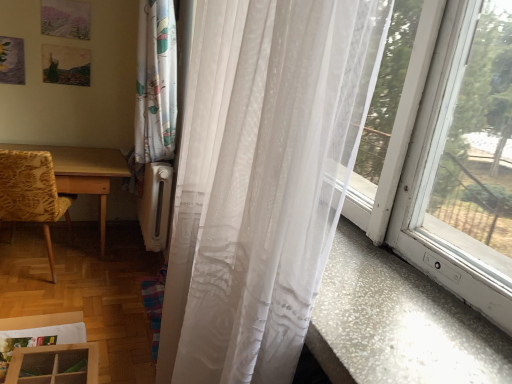
The width and height of the screenshot is (512, 384). Describe the element at coordinates (83, 172) in the screenshot. I see `wooden table at left` at that location.

Locate an element on the screen. wooden table at left is located at coordinates (83, 172).

Is yellow floral fabric chair at left positioned with its back to wooden table at left?

Yes, wooden table at left is at the back of yellow floral fabric chair at left.

Which of these two, yellow floral fabric chair at left or wooden table at left, is bigger?

wooden table at left is bigger.

In terms of width, does yellow floral fabric chair at left look wider or thinner when compared to wooden table at left?

Considering their sizes, yellow floral fabric chair at left looks slimmer than wooden table at left.

In the scene shown: Is yellow floral fabric chair at left taller than wooden table at left?

Correct, yellow floral fabric chair at left is much taller as wooden table at left.

How much distance is there between translucent white curtain at right and wooden table at left?

translucent white curtain at right is 2.03 meters away from wooden table at left.

Considering the sizes of objects translucent white curtain at right and wooden table at left in the image provided, who is shorter, translucent white curtain at right or wooden table at left?

wooden table at left is shorter.

Is translucent white curtain at right inside or outside of wooden table at left?

translucent white curtain at right is located beyond the bounds of wooden table at left.

Who is smaller, translucent white curtain at right or wooden table at left?

translucent white curtain at right.

How distant is translucent white curtain at right from yellow floral fabric chair at left?

translucent white curtain at right and yellow floral fabric chair at left are 5.77 feet apart from each other.

Which object is wider, translucent white curtain at right or yellow floral fabric chair at left?

Wider between the two is yellow floral fabric chair at left.

Is the depth of translucent white curtain at right less than that of yellow floral fabric chair at left?

Yes.

Is translucent white curtain at right positioned with its back to yellow floral fabric chair at left?

translucent white curtain at right is not turned away from yellow floral fabric chair at left.

Is yellow floral fabric chair at left taller than translucent white curtain at right?

In fact, yellow floral fabric chair at left may be shorter than translucent white curtain at right.

Could you tell me if yellow floral fabric chair at left is turned towards translucent white curtain at right?

No, yellow floral fabric chair at left is not oriented towards translucent white curtain at right.

Considering the relative positions of yellow floral fabric chair at left and translucent white curtain at right in the image provided, is yellow floral fabric chair at left to the right of translucent white curtain at right from the viewer's perspective?

Incorrect, yellow floral fabric chair at left is not on the right side of translucent white curtain at right.

From the image's perspective, between yellow floral fabric chair at left and translucent white curtain at right, who is located below?

translucent white curtain at right.

Does wooden table at left come in front of yellow floral fabric chair at left?

No, it is behind yellow floral fabric chair at left.

Which of these two, wooden table at left or yellow floral fabric chair at left, is smaller?

yellow floral fabric chair at left.

Does wooden table at left turn towards yellow floral fabric chair at left?

Yes.

Between wooden table at left and yellow floral fabric chair at left, which one has less height?

wooden table at left.

Which is correct: wooden table at left is inside translucent white curtain at right, or outside of it?

The correct answer is: outside.

Who is shorter, wooden table at left or translucent white curtain at right?

With less height is wooden table at left.

Which object is further away from the camera, wooden table at left or translucent white curtain at right?

wooden table at left is behind.

How much distance is there between wooden table at left and translucent white curtain at right?

They are 2.03 meters apart.

What are the coordinates of `chair on the left of wooden table at left` in the screenshot? It's located at (32, 193).

I want to click on table lying above the translucent white curtain at right (from the image's perspective), so click(83, 172).

Estimate the real-world distances between objects in this image. Which object is further from yellow floral fabric chair at left, wooden table at left or translucent white curtain at right?

translucent white curtain at right lies further to yellow floral fabric chair at left than the other object.

When comparing their distances from translucent white curtain at right, does yellow floral fabric chair at left or wooden table at left seem further?

wooden table at left is further to translucent white curtain at right.

Based on their spatial positions, is yellow floral fabric chair at left or translucent white curtain at right closer to wooden table at left?

yellow floral fabric chair at left.

From the image, which object appears to be farther from translucent white curtain at right, wooden table at left or yellow floral fabric chair at left?

wooden table at left is further to translucent white curtain at right.

Based on their spatial positions, is translucent white curtain at right or wooden table at left closer to yellow floral fabric chair at left?

Among the two, wooden table at left is located nearer to yellow floral fabric chair at left.

Which object lies further to the anchor point wooden table at left, translucent white curtain at right or yellow floral fabric chair at left?

Based on the image, translucent white curtain at right appears to be further to wooden table at left.

This screenshot has height=384, width=512. Find the location of `chair located between translucent white curtain at right and wooden table at left in the depth direction`. chair located between translucent white curtain at right and wooden table at left in the depth direction is located at coordinates (32, 193).